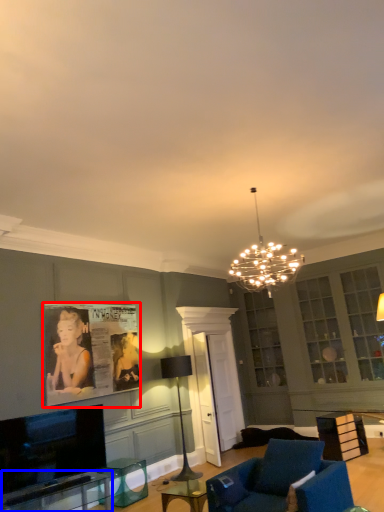
Question: Which object appears farthest to the camera in this image, picture frame (highlighted by a red box) or table (highlighted by a blue box)?

Choices:
 (A) picture frame
 (B) table

Answer: (A)